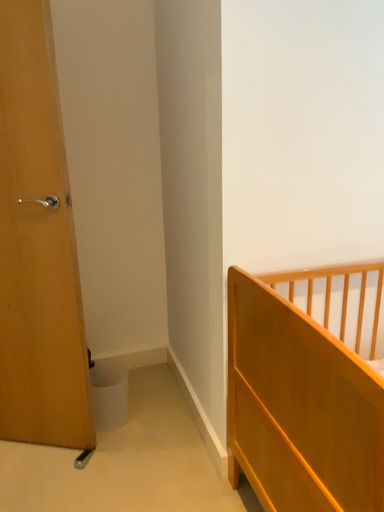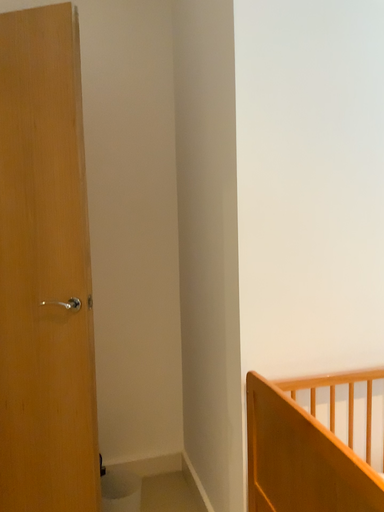
Question: Which way did the camera rotate in the video?

Choices:
 (A) rotated downward
 (B) rotated upward

Answer: (B)